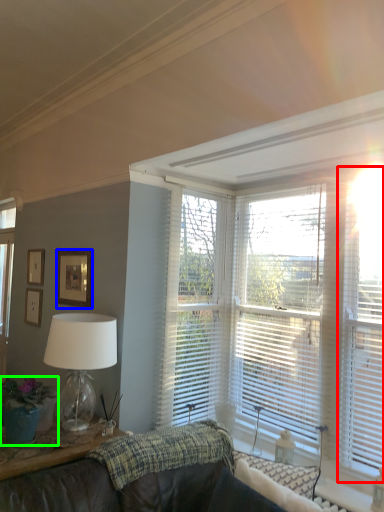
Question: Which is nearer to the blind (highlighted by a red box)? picture frame (highlighted by a blue box) or houseplant (highlighted by a green box).

Choices:
 (A) picture frame
 (B) houseplant

Answer: (A)